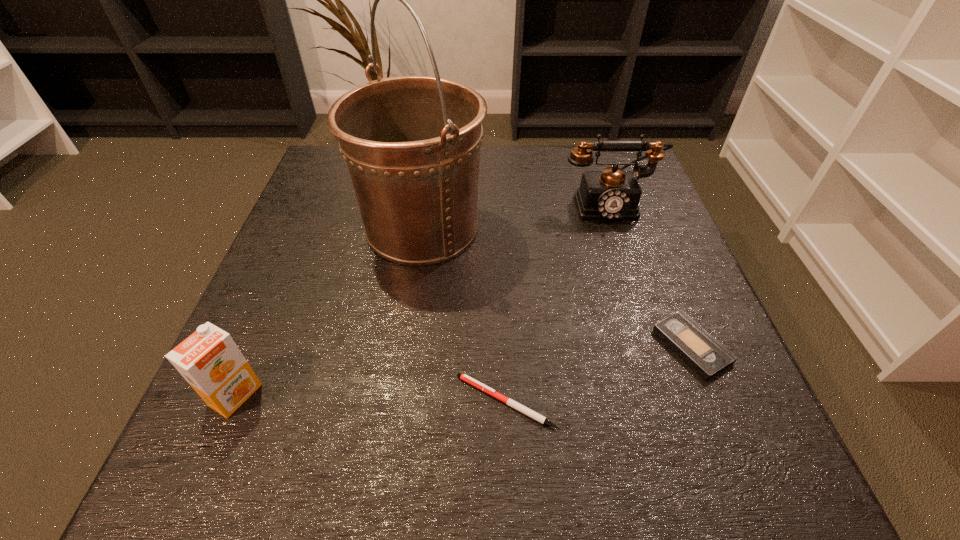
I want to click on object that is at the far left corner, so click(412, 144).

At what (x,y) coordinates should I click in order to perform the action: click on object that is at the far right corner. Please return your answer as a coordinate pair (x, y). Looking at the image, I should click on (612, 194).

Identify the location of free space at the near edge of the desktop. The image size is (960, 540). (587, 465).

In the image, there is a desktop. What are the coordinates of `vacant space at the left edge` in the screenshot? It's located at (353, 270).

The height and width of the screenshot is (540, 960). Find the location of `vacant space at the right edge`. vacant space at the right edge is located at coordinates (634, 271).

You are a GUI agent. You are given a task and a screenshot of the screen. Output one action in this format:
    pyautogui.click(x=<x>, y=<y>)
    Task: Click on the free location at the near left corner of the desktop
    This screenshot has width=960, height=540.
    Given the screenshot: What is the action you would take?
    pyautogui.click(x=165, y=495)

Where is `free spot between the fourth tallest object and the pen`? Image resolution: width=960 pixels, height=540 pixels. free spot between the fourth tallest object and the pen is located at coordinates (599, 374).

The width and height of the screenshot is (960, 540). What are the coordinates of `vacant area that lies between the videotape and the bucket` in the screenshot? It's located at (557, 287).

Where is `unoccupied area between the orange juice and the videotape`? unoccupied area between the orange juice and the videotape is located at coordinates (464, 370).

You are a GUI agent. You are given a task and a screenshot of the screen. Output one action in this format:
    pyautogui.click(x=<x>, y=<y>)
    Task: Click on the unoccupied position between the leftmost object and the telephone
    The image size is (960, 540).
    Given the screenshot: What is the action you would take?
    pyautogui.click(x=421, y=299)